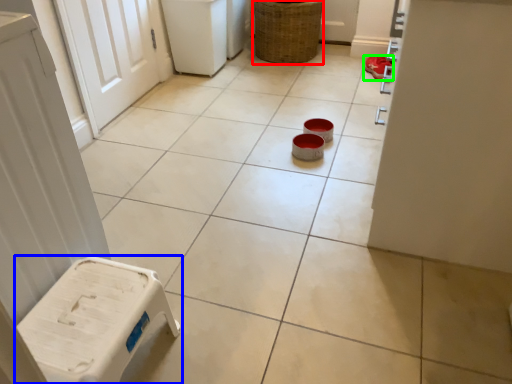
Question: Which is farther away from basket (highlighted by a red box)? furniture (highlighted by a blue box) or footwear (highlighted by a green box)?

Choices:
 (A) furniture
 (B) footwear

Answer: (A)